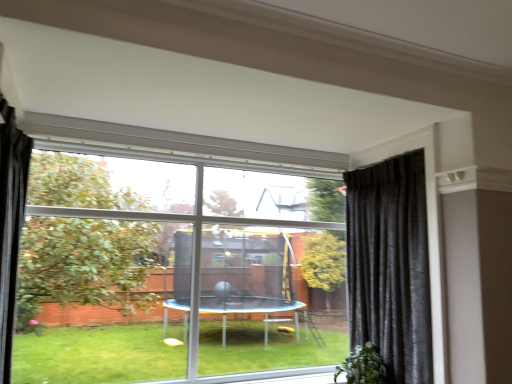
Question: From a real-world perspective, is green leafy plant at lower right beneath black velvet curtain at right, which ranks as the first curtain in back-to-front order?

Choices:
 (A) no
 (B) yes

Answer: (B)

Question: Considering the relative positions of green leafy plant at lower right and black velvet curtain at right, which ranks as the first curtain in back-to-front order, in the image provided, is green leafy plant at lower right in front of black velvet curtain at right, which ranks as the first curtain in back-to-front order,?

Choices:
 (A) no
 (B) yes

Answer: (A)

Question: Is green leafy plant at lower right positioned behind black velvet curtain at right, which ranks as the first curtain in back-to-front order?

Choices:
 (A) no
 (B) yes

Answer: (B)

Question: Is green leafy plant at lower right to the left of black velvet curtain at right, acting as the 2th curtain starting from the left, from the viewer's perspective?

Choices:
 (A) yes
 (B) no

Answer: (A)

Question: From the image's perspective, is green leafy plant at lower right on top of black velvet curtain at right, positioned as the 1th curtain in right-to-left order?

Choices:
 (A) yes
 (B) no

Answer: (B)

Question: Does green leafy plant at lower right have a lesser width compared to black velvet curtain at right, which is counted as the second curtain, starting from the front?

Choices:
 (A) yes
 (B) no

Answer: (B)

Question: Can you confirm if transparent glass window at center is thinner than black velvet curtain at left, which appears as the 2th curtain when viewed from the right?

Choices:
 (A) no
 (B) yes

Answer: (A)

Question: From a real-world perspective, is transparent glass window at center positioned under black velvet curtain at left, positioned as the 1th curtain in left-to-right order, based on gravity?

Choices:
 (A) yes
 (B) no

Answer: (A)

Question: From the image's perspective, is transparent glass window at center beneath black velvet curtain at left, placed as the 2th curtain when sorted from back to front?

Choices:
 (A) no
 (B) yes

Answer: (B)

Question: Can you confirm if transparent glass window at center is taller than black velvet curtain at left, placed as the first curtain when sorted from front to back?

Choices:
 (A) no
 (B) yes

Answer: (B)

Question: Is transparent glass window at center positioned before black velvet curtain at left, placed as the first curtain when sorted from front to back?

Choices:
 (A) no
 (B) yes

Answer: (A)

Question: Can you confirm if transparent glass window at center is smaller than black velvet curtain at left, positioned as the 1th curtain in left-to-right order?

Choices:
 (A) no
 (B) yes

Answer: (A)

Question: From a real-world perspective, is transparent glass window at center over green leafy plant at lower right?

Choices:
 (A) no
 (B) yes

Answer: (B)